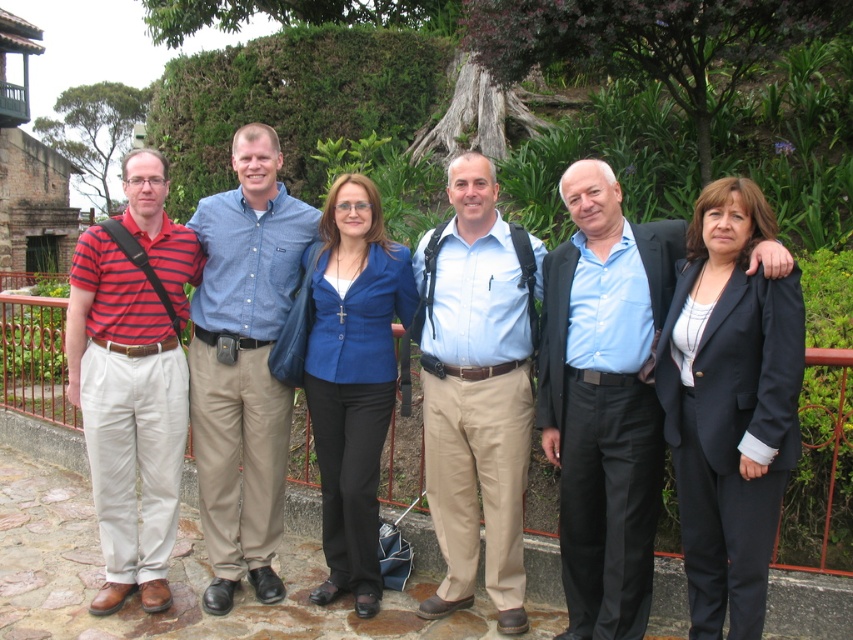
Which is more to the left, matte blue blazer at center or blue shirt at center?

matte blue blazer at center is more to the left.

Which of these two, matte blue blazer at center or blue shirt at center, stands shorter?

Standing shorter between the two is blue shirt at center.

Locate an element on the screen. matte blue blazer at center is located at coordinates (248, 241).

You are a GUI agent. You are given a task and a screenshot of the screen. Output one action in this format:
    pyautogui.click(x=<x>, y=<y>)
    Task: Click on the matte blue blazer at center
    This screenshot has height=640, width=853.
    Given the screenshot: What is the action you would take?
    pyautogui.click(x=248, y=241)

Which is more to the right, light blue shirt at center or striped cotton polo shirt at left?

light blue shirt at center

Does light blue shirt at center have a lesser width compared to striped cotton polo shirt at left?

Correct, light blue shirt at center's width is less than striped cotton polo shirt at left's.

The width and height of the screenshot is (853, 640). What do you see at coordinates (477, 388) in the screenshot? I see `light blue shirt at center` at bounding box center [477, 388].

Where is `light blue shirt at center`? This screenshot has width=853, height=640. light blue shirt at center is located at coordinates (477, 388).

Is point (459, 566) behind point (239, 392)?

That is False.

Based on the photo, which is more to the right, light blue shirt at center or blue denim shirt at center?

From the viewer's perspective, light blue shirt at center appears more on the right side.

What do you see at coordinates (477, 388) in the screenshot? The height and width of the screenshot is (640, 853). I see `light blue shirt at center` at bounding box center [477, 388].

This screenshot has height=640, width=853. Identify the location of light blue shirt at center. (477, 388).